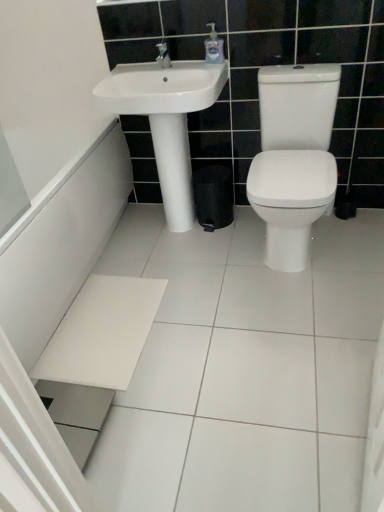
Image resolution: width=384 pixels, height=512 pixels. What do you see at coordinates (162, 87) in the screenshot?
I see `white glossy sink at upper center` at bounding box center [162, 87].

This screenshot has height=512, width=384. I want to click on clear plastic soap dispenser at upper center, so click(214, 46).

What do you see at coordinates (294, 158) in the screenshot? I see `white glossy toilet at right` at bounding box center [294, 158].

At what (x,y) coordinates should I click in order to perform the action: click on white glossy sink at upper center. Please return your answer as a coordinate pair (x, y). This screenshot has height=512, width=384. Looking at the image, I should click on (162, 87).

From the image's perspective, is white glossy sink at upper center over white ceramic tile at lower center?

Yes, from the image's perspective, white glossy sink at upper center is over white ceramic tile at lower center.

Is white glossy sink at upper center inside or outside of white ceramic tile at lower center?

white glossy sink at upper center is not enclosed by white ceramic tile at lower center.

Is point (158, 77) more distant than point (225, 375)?

Yes, it is.

Based on the photo, which object is positioned more to the left, white glossy sink at upper center or white ceramic tile at lower center?

From the viewer's perspective, white glossy sink at upper center appears more on the left side.

Can you confirm if white glossy toilet at right is bigger than white glossy sink at upper center?

Yes.

Considering the sizes of objects white glossy toilet at right and white glossy sink at upper center in the image provided, who is shorter, white glossy toilet at right or white glossy sink at upper center?

Standing shorter between the two is white glossy sink at upper center.

Is the depth of white glossy toilet at right less than that of white glossy sink at upper center?

Yes, it is.

Is white glossy toilet at right to the right of clear plastic soap dispenser at upper center from the viewer's perspective?

Yes, white glossy toilet at right is to the right of clear plastic soap dispenser at upper center.

Choose the correct answer: Is white glossy toilet at right inside clear plastic soap dispenser at upper center or outside it?

white glossy toilet at right is outside clear plastic soap dispenser at upper center.

Can you see white glossy toilet at right touching clear plastic soap dispenser at upper center?

No, white glossy toilet at right is not next to clear plastic soap dispenser at upper center.

From the image's perspective, is white ceramic tile at lower center over white glossy toilet at right?

No, from the image's perspective, white ceramic tile at lower center is not above white glossy toilet at right.

Considering the relative positions of white ceramic tile at lower center and white glossy toilet at right in the image provided, is white ceramic tile at lower center in front of white glossy toilet at right?

That is True.

Is white ceramic tile at lower center not near white glossy toilet at right?

They are positioned close to each other.

Considering the sizes of white ceramic tile at lower center and white glossy toilet at right in the image, is white ceramic tile at lower center taller or shorter than white glossy toilet at right?

white ceramic tile at lower center is shorter than white glossy toilet at right.

Is point (75, 368) less distant than point (201, 108)?

Yes, it is.

Locate an element on the screen. Image resolution: width=384 pixels, height=512 pixels. sink above the white glossy bath at lower left (from the image's perspective) is located at coordinates (162, 87).

Between white glossy bath at lower left and white glossy sink at upper center, which one has less height?

Standing shorter between the two is white glossy sink at upper center.

Between white glossy bath at lower left and white glossy sink at upper center, which one appears on the left side from the viewer's perspective?

white glossy bath at lower left.

From a real-world perspective, is white ceramic tile at lower center below clear plastic soap dispenser at upper center?

Correct, in the physical world, white ceramic tile at lower center is lower than clear plastic soap dispenser at upper center.

Find the location of `ceramic tile directly beneath the clear plastic soap dispenser at upper center (from a real-world perspective)`. ceramic tile directly beneath the clear plastic soap dispenser at upper center (from a real-world perspective) is located at coordinates (x=244, y=369).

Does point (368, 344) come closer to viewer compared to point (207, 41)?

That is True.

Is white ceramic tile at lower center bigger than clear plastic soap dispenser at upper center?

Indeed, white ceramic tile at lower center has a larger size compared to clear plastic soap dispenser at upper center.

Is white glossy sink at upper center facing away from white glossy bath at lower left?

No.

From the image's perspective, relative to white glossy bath at lower left, is white glossy sink at upper center above or below?

white glossy sink at upper center is above white glossy bath at lower left.

From a real-world perspective, which is physically above, white glossy sink at upper center or white glossy bath at lower left?

white glossy sink at upper center, from a real-world perspective.

Considering the relative sizes of white glossy sink at upper center and white glossy bath at lower left in the image provided, is white glossy sink at upper center bigger than white glossy bath at lower left?

No.

Find the location of a particular element. sink that appears above the white ceramic tile at lower center (from the image's perspective) is located at coordinates (162, 87).

In order to click on sink that is behind the white glossy toilet at right in this screenshot , I will do `click(162, 87)`.

Looking at the image, which one is located closer to white glossy sink at upper center, white glossy bath at lower left or white glossy toilet at right?

The object closer to white glossy sink at upper center is white glossy toilet at right.

Estimate the real-world distances between objects in this image. Which object is closer to white glossy sink at upper center, white glossy toilet at right or clear plastic soap dispenser at upper center?

clear plastic soap dispenser at upper center lies closer to white glossy sink at upper center than the other object.

From the image, which object appears to be farther from clear plastic soap dispenser at upper center, white ceramic tile at lower center or white glossy sink at upper center?

white ceramic tile at lower center is further to clear plastic soap dispenser at upper center.

Considering their positions, is white glossy toilet at right positioned closer to white glossy sink at upper center than white glossy bath at lower left?

white glossy toilet at right.

Considering their positions, is clear plastic soap dispenser at upper center positioned closer to white ceramic tile at lower center than white glossy toilet at right?

Based on the image, white glossy toilet at right appears to be nearer to white ceramic tile at lower center.

Based on their spatial positions, is white ceramic tile at lower center or clear plastic soap dispenser at upper center further from white glossy toilet at right?

The object further to white glossy toilet at right is clear plastic soap dispenser at upper center.

Looking at the image, which one is located further to white ceramic tile at lower center, white glossy toilet at right or white glossy sink at upper center?

The object further to white ceramic tile at lower center is white glossy sink at upper center.

Considering their positions, is white glossy sink at upper center positioned further to white glossy bath at lower left than white glossy toilet at right?

white glossy toilet at right is positioned further to the anchor white glossy bath at lower left.

Locate an element on the screen. This screenshot has height=512, width=384. toilet between white glossy sink at upper center and white ceramic tile at lower center from top to bottom is located at coordinates (294, 158).

Find the location of a particular element. The height and width of the screenshot is (512, 384). sink located between white glossy bath at lower left and white glossy toilet at right in the left-right direction is located at coordinates (162, 87).

Identify the location of bath between white glossy sink at upper center and white ceramic tile at lower center vertically. The width and height of the screenshot is (384, 512). (x=77, y=297).

You are a GUI agent. You are given a task and a screenshot of the screen. Output one action in this format:
    pyautogui.click(x=<x>, y=<y>)
    Task: Click on the soap dispenser between white glossy bath at lower left and white glossy toilet at right from left to right
    
    Given the screenshot: What is the action you would take?
    pyautogui.click(x=214, y=46)